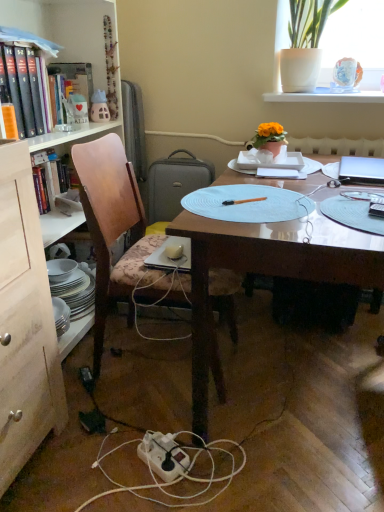
The image size is (384, 512). I want to click on free space in front of clear plastic pen at center, so click(x=358, y=218).